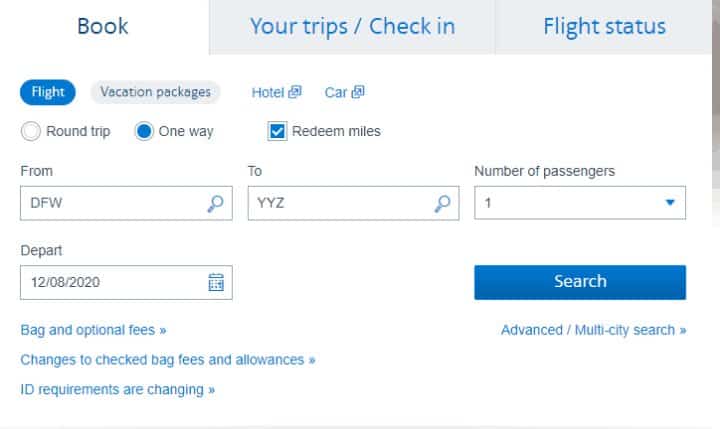
Where is `book`? This screenshot has height=429, width=720. book is located at coordinates (99, 24).